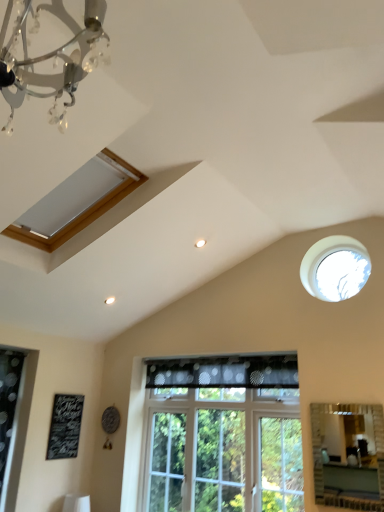
Question: Does black chalkboard at lower left have a lesser width compared to matte wooden window at upper left, the 3th window viewed from the right?

Choices:
 (A) yes
 (B) no

Answer: (A)

Question: Are black chalkboard at lower left and matte wooden window at upper left, which ranks as the first window in left-to-right order, beside each other?

Choices:
 (A) no
 (B) yes

Answer: (A)

Question: Is black chalkboard at lower left facing towards matte wooden window at upper left, which ranks as the first window in left-to-right order?

Choices:
 (A) no
 (B) yes

Answer: (A)

Question: Is black chalkboard at lower left to the left of matte wooden window at upper left, which ranks as the first window in left-to-right order, from the viewer's perspective?

Choices:
 (A) no
 (B) yes

Answer: (B)

Question: Is black chalkboard at lower left positioned beyond the bounds of matte wooden window at upper left, which appears as the first window when viewed from the top?

Choices:
 (A) no
 (B) yes

Answer: (B)

Question: From the image's perspective, would you say black chalkboard at lower left is positioned over matte wooden window at upper left, which appears as the first window when viewed from the top?

Choices:
 (A) yes
 (B) no

Answer: (B)

Question: From a real-world perspective, is clear glass window at center, the 2th window when ordered from left to right, under black dotted fabric at center?

Choices:
 (A) no
 (B) yes

Answer: (B)

Question: Does clear glass window at center, arranged as the 2th window when viewed from the right, have a smaller size compared to black dotted fabric at center?

Choices:
 (A) no
 (B) yes

Answer: (A)

Question: Is clear glass window at center, arranged as the 2th window when viewed from the right, facing towards black dotted fabric at center?

Choices:
 (A) yes
 (B) no

Answer: (A)

Question: Is the position of clear glass window at center, the 2th window when ordered from left to right, more distant than that of black dotted fabric at center?

Choices:
 (A) no
 (B) yes

Answer: (A)

Question: Is clear glass window at center, arranged as the 2th window when viewed from the right, facing away from black dotted fabric at center?

Choices:
 (A) yes
 (B) no

Answer: (A)

Question: Considering the relative sizes of clear glass window at center, the 2th window when ordered from left to right, and black dotted fabric at center in the image provided, is clear glass window at center, the 2th window when ordered from left to right, wider than black dotted fabric at center?

Choices:
 (A) no
 (B) yes

Answer: (A)

Question: From a real-world perspective, is matte silver mirror at lower right positioned over black chalkboard at lower left based on gravity?

Choices:
 (A) no
 (B) yes

Answer: (A)